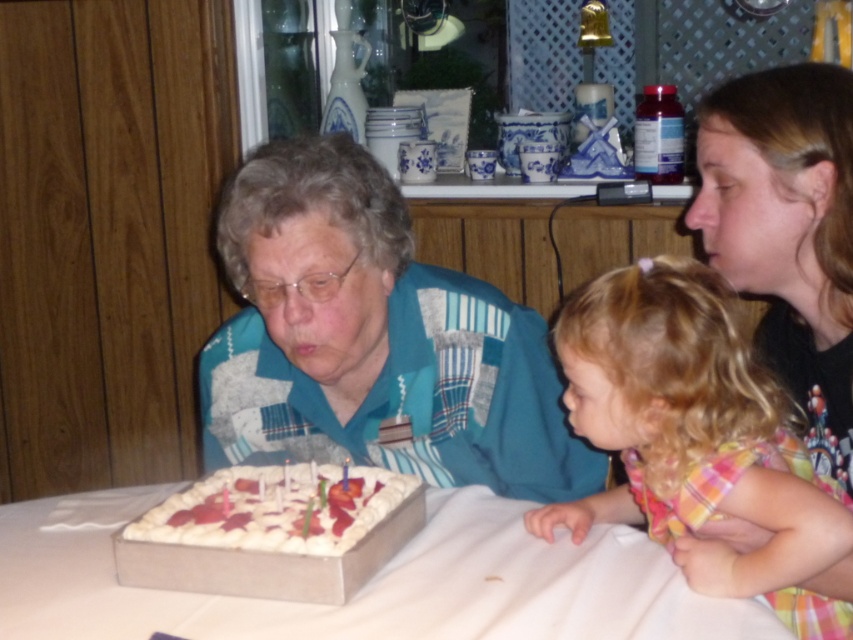
You are a photographer setting up for a birthday photo. You need to ensure the teal patchwork shirt at center and the white cardboard cake at lower center are both visible in the frame. Given their sizes, which object should you focus on first to ensure it doesn

The teal patchwork shirt at center is taller than the white cardboard cake at lower center, so you should focus on the teal patchwork shirt at center first to ensure it is fully in frame before adjusting for the cake.

Consider the image. You are a photographer taking a picture of the birthday scene. You need to ensure that both the teal patchwork shirt at center and the white cardboard cake at lower center are clearly visible. Which object should you focus on first to make sure it is in the foreground?

The teal patchwork shirt at center is positioned over the white cardboard cake at lower center, so focusing on the teal patchwork shirt at center first will ensure it is in the foreground.

You are a guest at this birthday celebration and want to place a small gift on the table where the cake is located. The table has two designated spots marked by points. The first spot is at point [763,220] and the second spot is at point [234,492]. From your perspective standing at the edge of the table, which point is closer to you?

Point [763,220] is in front of point [234,492], so from your perspective standing at the edge of the table, point [763,220] is closer to you.